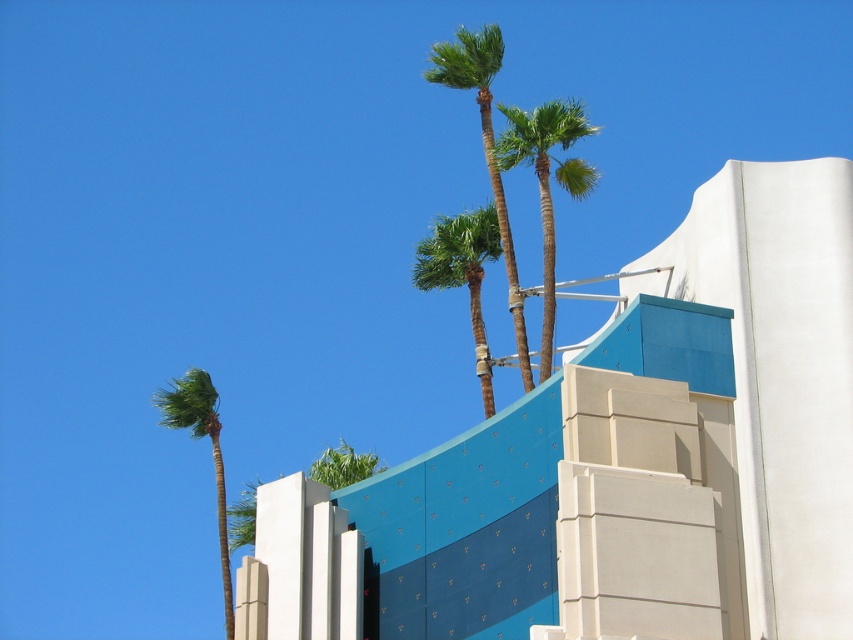
You are standing at the base of the tallest palm tree in the scene and want to reach the blue textured wall at upper center. If your walking speed is 1.5 meters per second, how many seconds will it take you to reach the wall?

The distance between you and the blue textured wall at upper center is 38.39 meters. At a walking speed of 1.5 meters per second, it will take approximately 25.59 seconds to reach the wall.

You are standing in front of the building and looking at the green leafy palm at upper center and the green leafy palm trees at upper center. Which one appears closer to you?

The green leafy palm at upper center appears closer because it is in front of the green leafy palm trees at upper center.